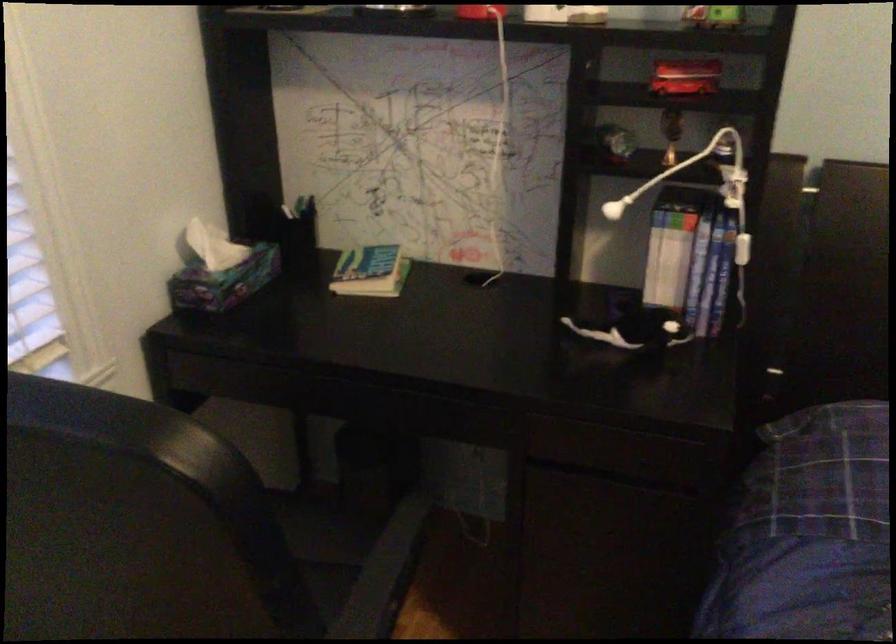
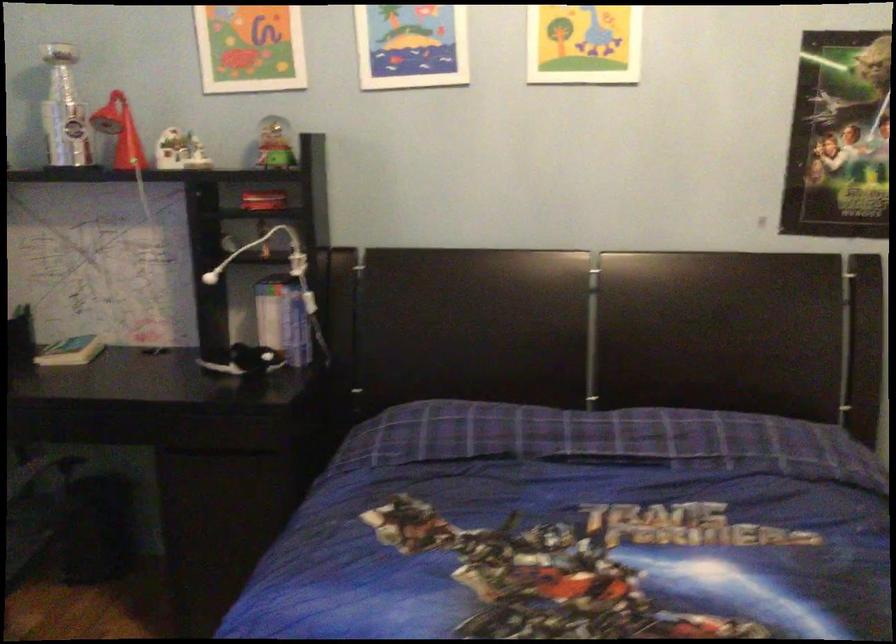
Find the pixel in the second image that matches point (375, 278) in the first image.

(71, 351)